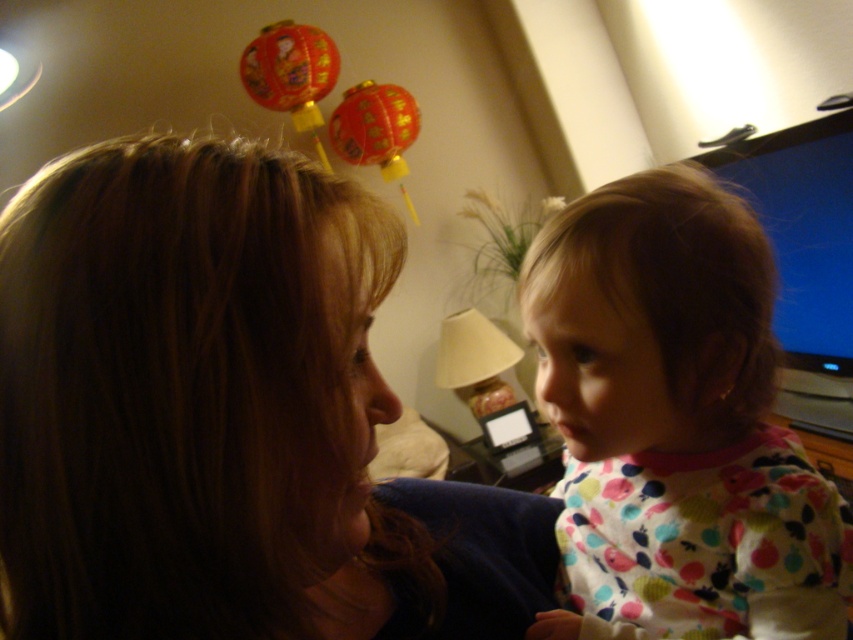
Consider the image. Does brown hair at upper left have a greater width compared to polka dot pajamas at right?

Yes, brown hair at upper left is wider than polka dot pajamas at right.

Does point (96, 420) lie behind point (563, 563)?

No.

Who is more forward, (128,289) or (685,484)?

Point (128,289) is more forward.

Where is `brown hair at upper left`? The height and width of the screenshot is (640, 853). brown hair at upper left is located at coordinates (224, 416).